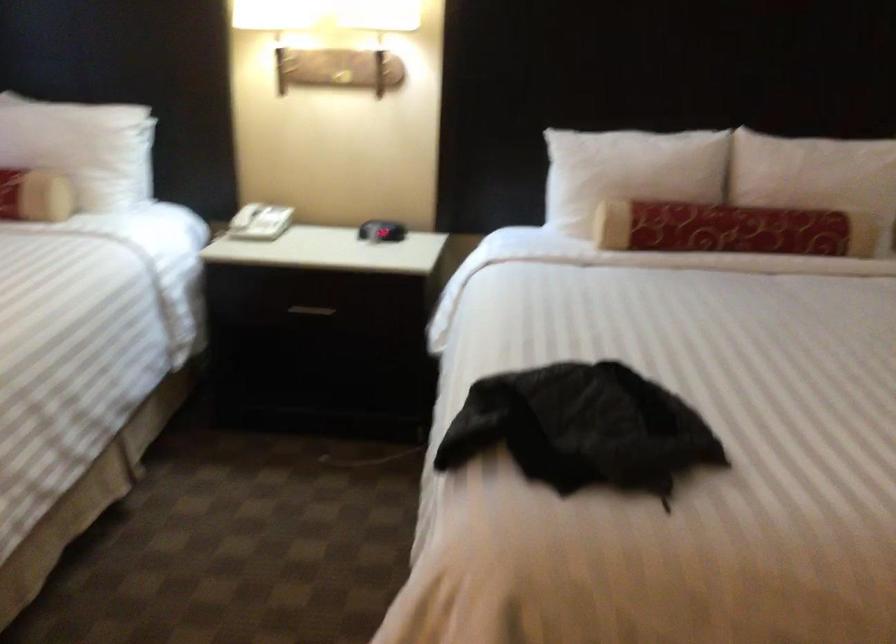
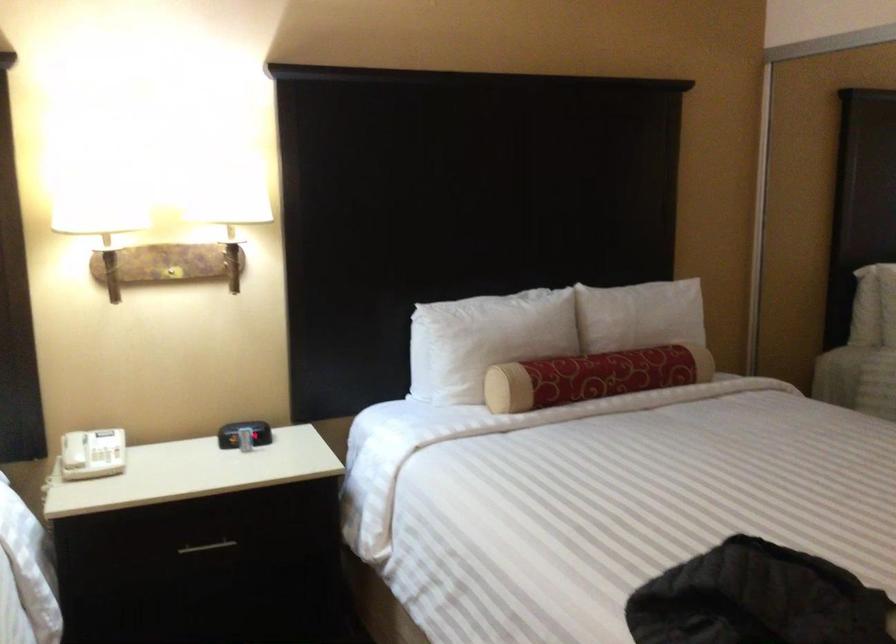
The point at (243,214) is marked in the first image. Where is the corresponding point in the second image?

(73, 450)